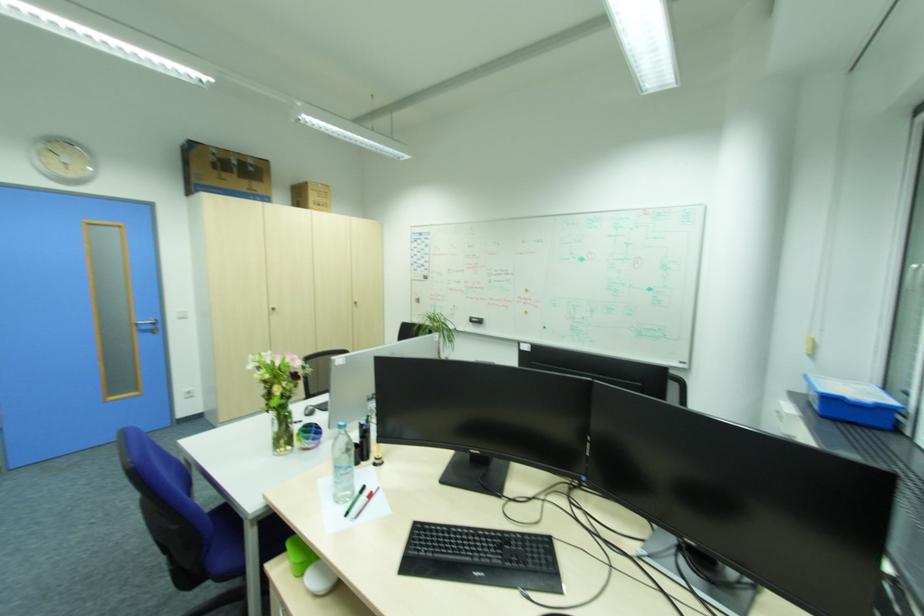
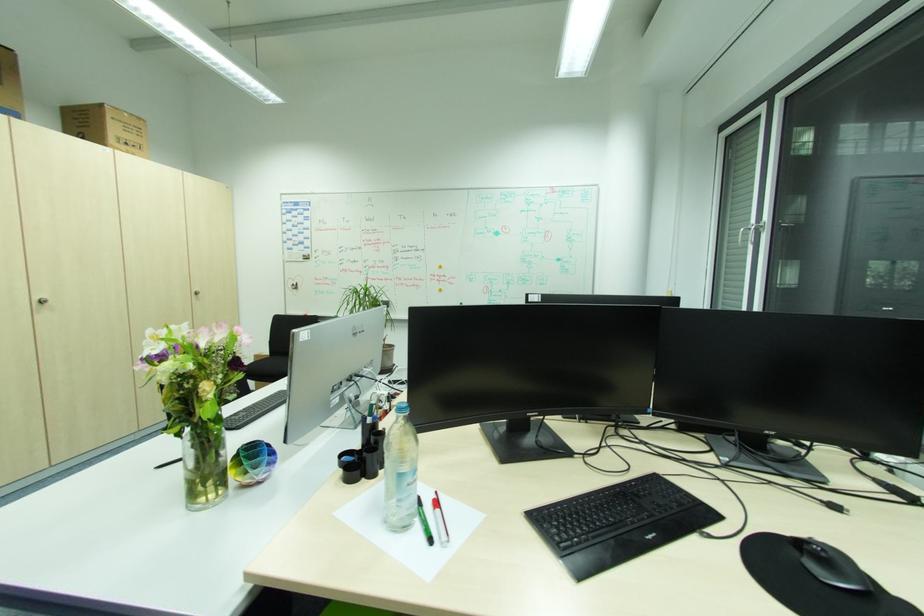
In the second image, find the point that corresponds to the point at 377,493 in the first image.

(440, 500)